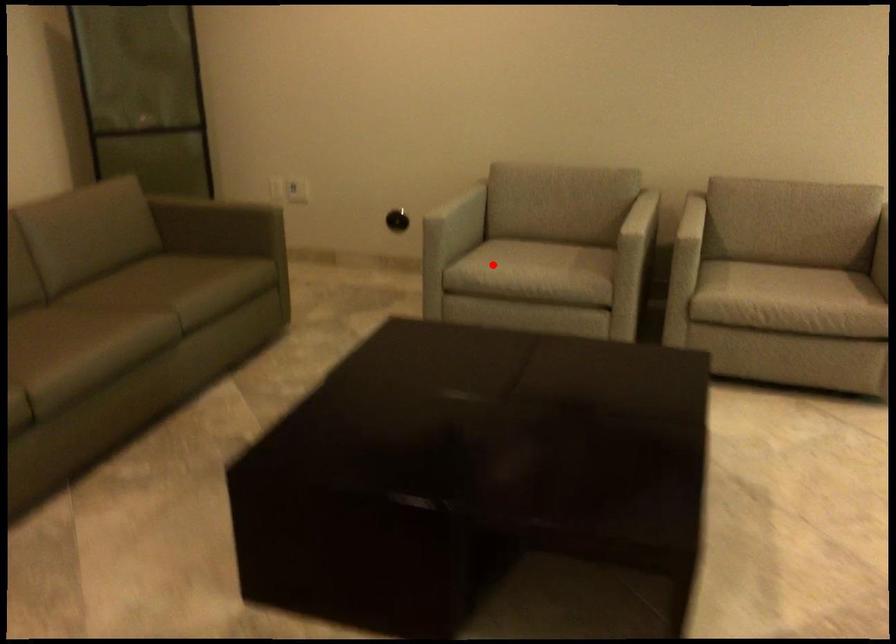
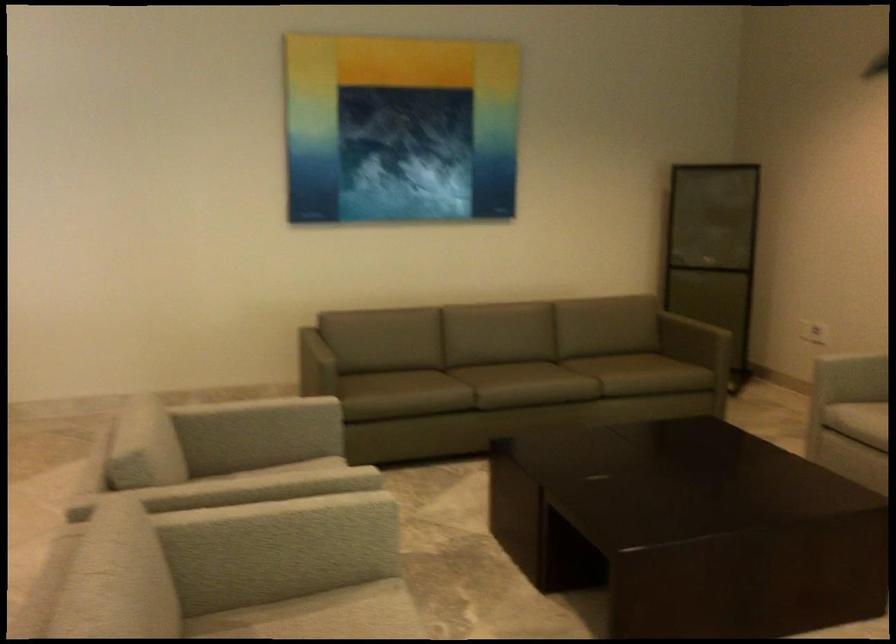
Find the pixel in the second image that matches the highlighted location in the first image.

(857, 420)